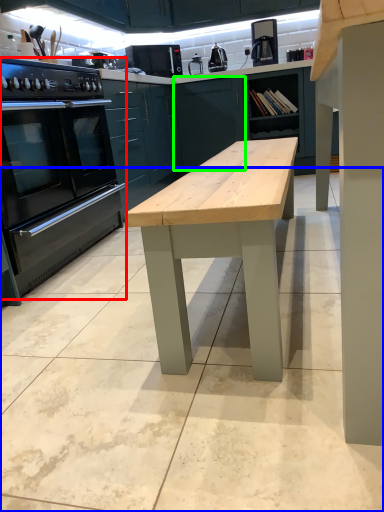
Question: Which is nearer to the home appliance (highlighted by a red box)? concrete (highlighted by a blue box) or cabinetry (highlighted by a green box).

Choices:
 (A) concrete
 (B) cabinetry

Answer: (A)